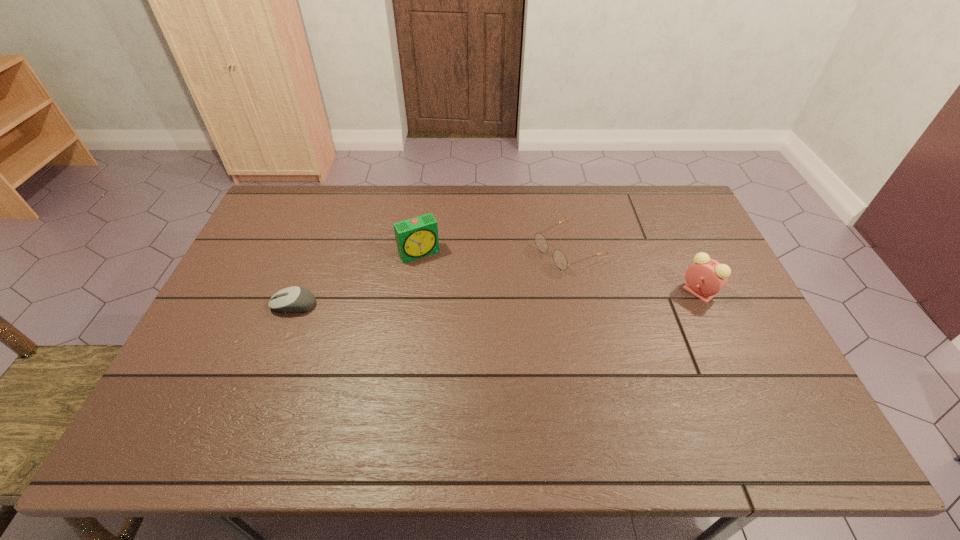
Locate an element on the screen. Image resolution: width=960 pixels, height=540 pixels. free space located on the temples of the spectacles is located at coordinates (528, 269).

Locate an element on the screen. free space located 0.310m on the temples of the spectacles is located at coordinates (455, 304).

The width and height of the screenshot is (960, 540). Identify the location of vacant space located 0.240m on the temples of the spectacles. (476, 294).

Locate an element on the screen. free location located 0.320m on the front-facing side of the second object from left to right is located at coordinates (471, 338).

The width and height of the screenshot is (960, 540). I want to click on blank area located 0.400m on the front-facing side of the second object from left to right, so click(485, 361).

Where is `vacant space situated 0.180m on the front-facing side of the second object from left to right`? The image size is (960, 540). vacant space situated 0.180m on the front-facing side of the second object from left to right is located at coordinates (450, 302).

Identify the location of object at the far edge. (559, 258).

Identify the location of object situated at the left edge. (295, 299).

The height and width of the screenshot is (540, 960). I want to click on object that is positioned at the right edge, so click(x=705, y=277).

Find the location of a particular element. Image resolution: width=960 pixels, height=540 pixels. vacant space at the far edge is located at coordinates (566, 203).